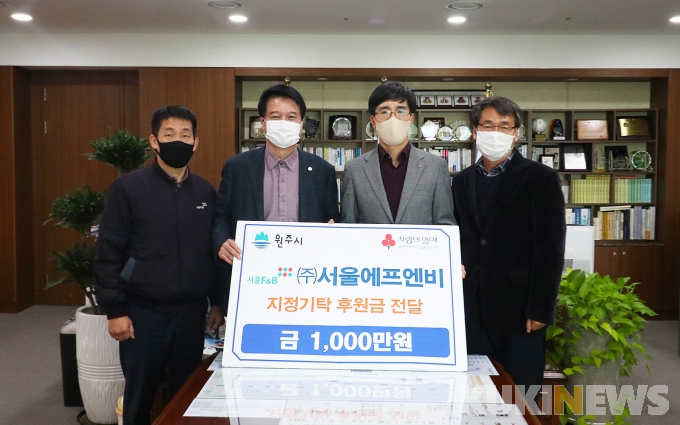
The width and height of the screenshot is (680, 425). Identify the location of plant. (588, 330).